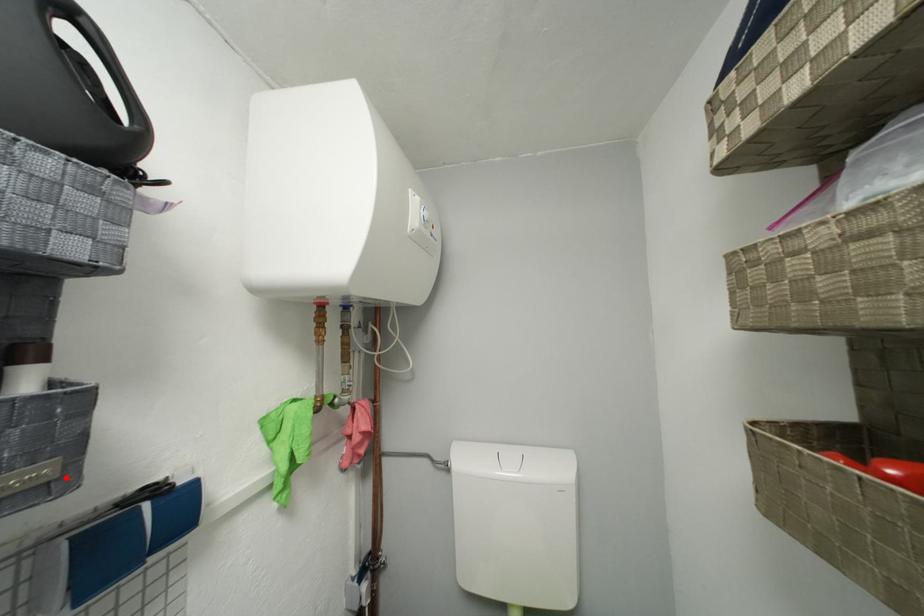
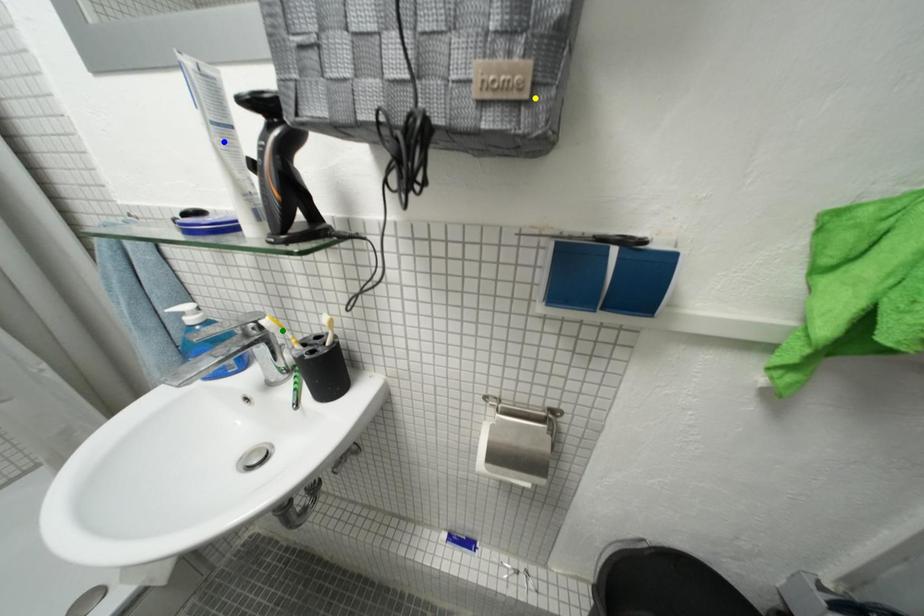
Question: I am providing you with two images of the same scene from different viewpoints. A red point is marked on the first image. You are given multiple points on the second image. Which point in image 2 is actually the same real-world point as the red point in image 1?

Choices:
 (A) green point
 (B) blue point
 (C) yellow point

Answer: (C)